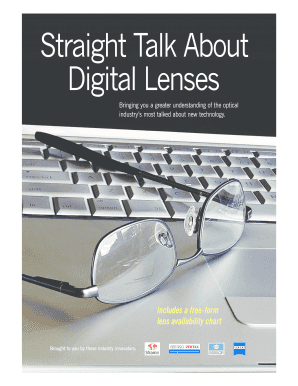
Find the location of a particular element. The image size is (298, 386). computer screen is located at coordinates (255, 99).